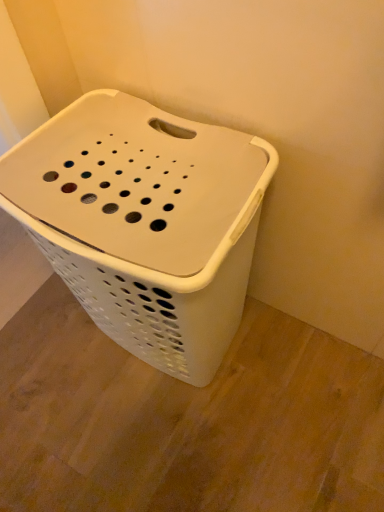
Locate an element on the screen. The height and width of the screenshot is (512, 384). blank space to the left of white plastic laundry basket at center is located at coordinates (49, 370).